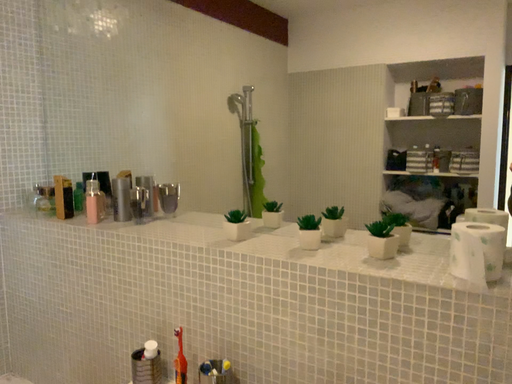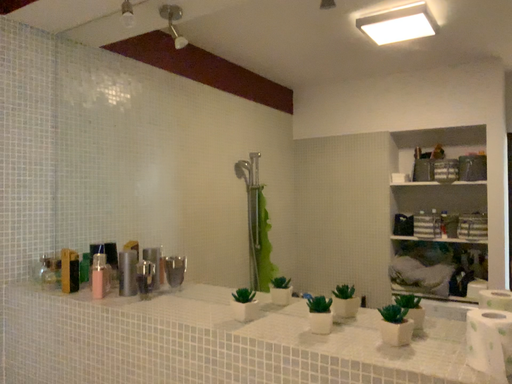
Question: Which way did the camera rotate in the video?

Choices:
 (A) rotated downward
 (B) rotated upward

Answer: (B)